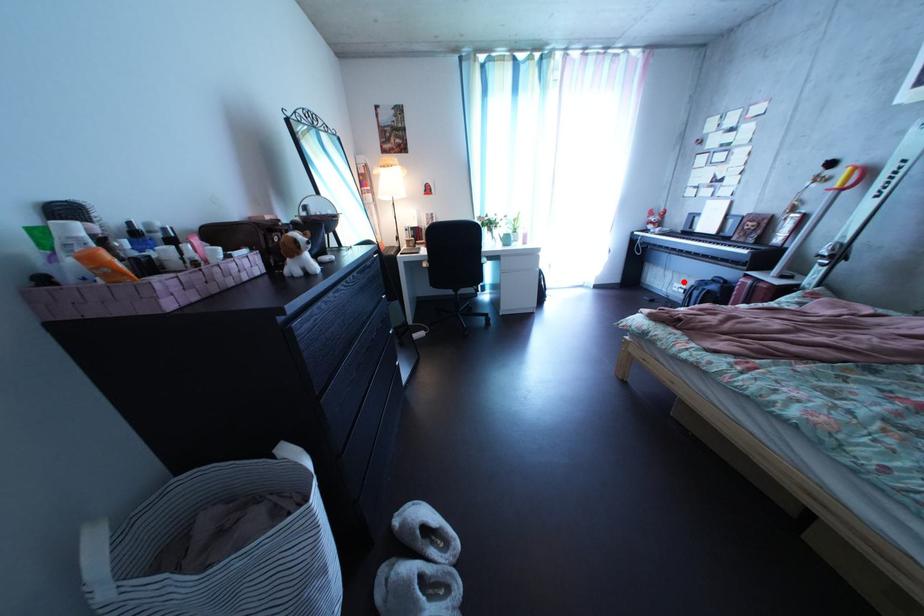
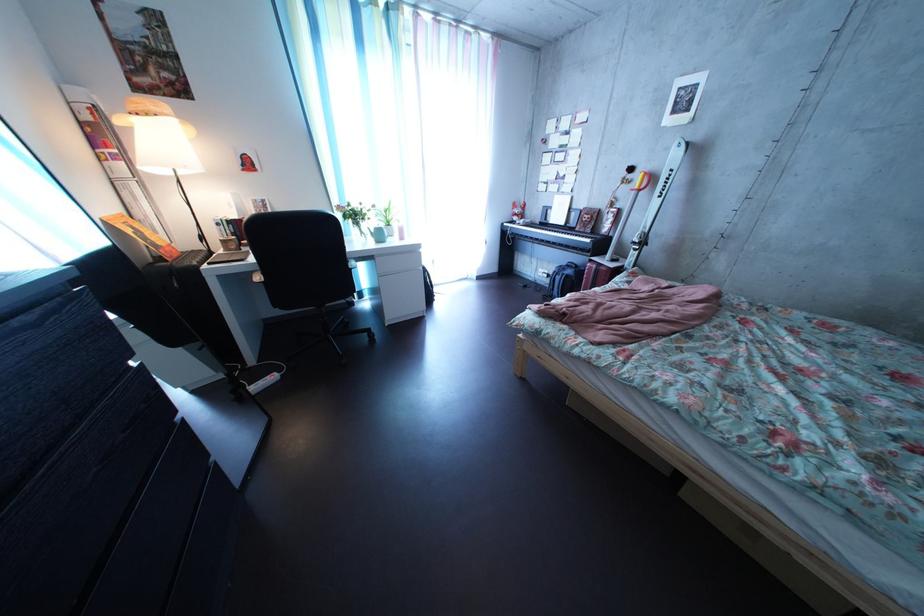
Find the pixel in the second image that matches the highlighted location in the first image.

(550, 269)